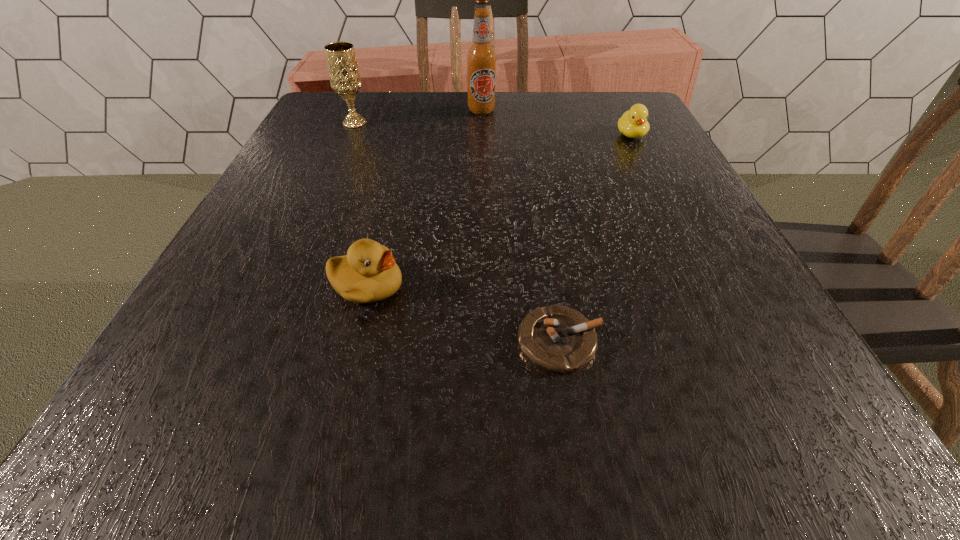
I want to click on object at the far left corner, so click(344, 75).

The image size is (960, 540). I want to click on object situated at the far right corner, so coord(633,123).

In the image, there is a desktop. At what (x,y) coordinates should I click in order to perform the action: click on free space at the far edge. Please return your answer as a coordinate pair (x, y). This screenshot has height=540, width=960. Looking at the image, I should click on (519, 134).

This screenshot has width=960, height=540. Identify the location of vacant space at the near edge of the desktop. (541, 429).

I want to click on free location at the left edge, so click(x=196, y=370).

This screenshot has height=540, width=960. In the image, there is a desktop. In order to click on free space at the right edge in this screenshot , I will do `click(717, 304)`.

Locate an element on the screen. The width and height of the screenshot is (960, 540). vacant area at the far left corner is located at coordinates (347, 110).

Locate an element on the screen. vacant area at the near left corner of the desktop is located at coordinates (199, 430).

Locate an element on the screen. Image resolution: width=960 pixels, height=540 pixels. vacant space at the far right corner of the desktop is located at coordinates (592, 109).

Where is `free space at the near right corner of the desktop`? free space at the near right corner of the desktop is located at coordinates (733, 465).